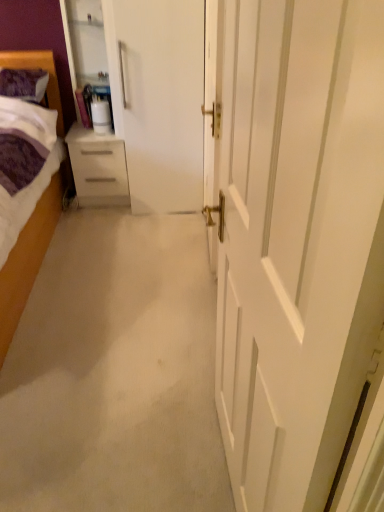
Question: Is transparent glass cabinet at upper left shorter than white glossy door at center?

Choices:
 (A) no
 (B) yes

Answer: (B)

Question: Can you confirm if transparent glass cabinet at upper left is smaller than white glossy door at center?

Choices:
 (A) no
 (B) yes

Answer: (A)

Question: Is transparent glass cabinet at upper left positioned far away from white glossy door at center?

Choices:
 (A) yes
 (B) no

Answer: (A)

Question: Does transparent glass cabinet at upper left have a larger size compared to white glossy door at center?

Choices:
 (A) yes
 (B) no

Answer: (A)

Question: Is transparent glass cabinet at upper left positioned in front of white glossy door at center?

Choices:
 (A) yes
 (B) no

Answer: (B)

Question: Is purple soft pillow at upper left to the left or to the right of white glossy chest of drawers at left in the image?

Choices:
 (A) right
 (B) left

Answer: (B)

Question: Do you think purple soft pillow at upper left is within white glossy chest of drawers at left, or outside of it?

Choices:
 (A) inside
 (B) outside

Answer: (B)

Question: Is purple soft pillow at upper left wider or thinner than white glossy chest of drawers at left?

Choices:
 (A) wide
 (B) thin

Answer: (B)

Question: From the image's perspective, relative to white glossy chest of drawers at left, is purple soft pillow at upper left above or below?

Choices:
 (A) above
 (B) below

Answer: (A)

Question: From a real-world perspective, relative to white glossy chest of drawers at left, is transparent glass cabinet at upper left vertically above or below?

Choices:
 (A) below
 (B) above

Answer: (B)

Question: Considering the relative positions of transparent glass cabinet at upper left and white glossy chest of drawers at left in the image provided, is transparent glass cabinet at upper left to the left or to the right of white glossy chest of drawers at left?

Choices:
 (A) right
 (B) left

Answer: (A)

Question: Is transparent glass cabinet at upper left wider or thinner than white glossy chest of drawers at left?

Choices:
 (A) wide
 (B) thin

Answer: (B)

Question: Is point (109, 135) positioned closer to the camera than point (117, 156)?

Choices:
 (A) closer
 (B) farther

Answer: (A)

Question: Relative to purple soft fabric bed at left, is purple soft pillow at upper left in front or behind?

Choices:
 (A) behind
 (B) front

Answer: (A)

Question: Considering the positions of purple soft pillow at upper left and purple soft fabric bed at left in the image, is purple soft pillow at upper left bigger or smaller than purple soft fabric bed at left?

Choices:
 (A) big
 (B) small

Answer: (B)